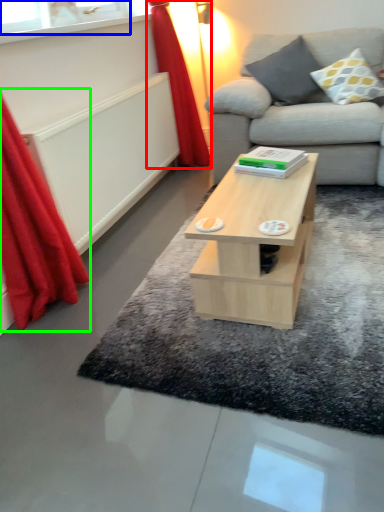
Question: Which is farther away from curtain (highlighted by a red box)? window (highlighted by a blue box) or curtain (highlighted by a green box)?

Choices:
 (A) window
 (B) curtain

Answer: (B)